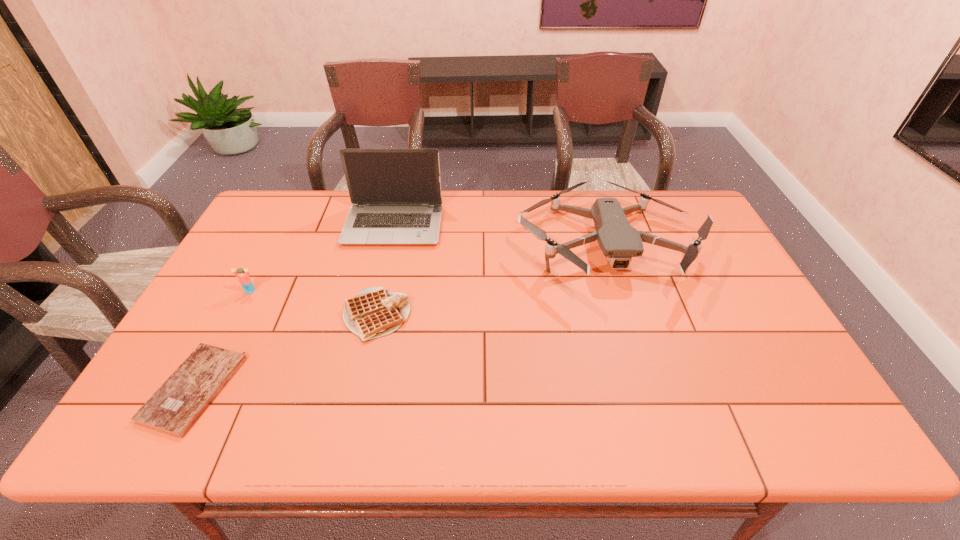
Identify the location of free space located on the left of the waffle. The image size is (960, 540). (229, 315).

Locate an element on the screen. The image size is (960, 540). blank area located 0.160m on the back of the nearest object is located at coordinates (242, 300).

Image resolution: width=960 pixels, height=540 pixels. Find the location of `laptop computer at the far edge`. laptop computer at the far edge is located at coordinates [396, 198].

I want to click on drone that is at the far edge, so click(619, 241).

I want to click on object that is at the near edge, so click(175, 407).

Image resolution: width=960 pixels, height=540 pixels. In order to click on Lego that is positioned at the left edge in this screenshot , I will do `click(244, 279)`.

Find the location of a particular element. The height and width of the screenshot is (540, 960). Bible that is positioned at the left edge is located at coordinates (175, 407).

Locate an element on the screen. Image resolution: width=960 pixels, height=540 pixels. object that is at the right edge is located at coordinates (619, 241).

Identify the location of object present at the near left corner. (175, 407).

This screenshot has height=540, width=960. What are the coordinates of `object located in the far right corner section of the desktop` in the screenshot? It's located at (619, 241).